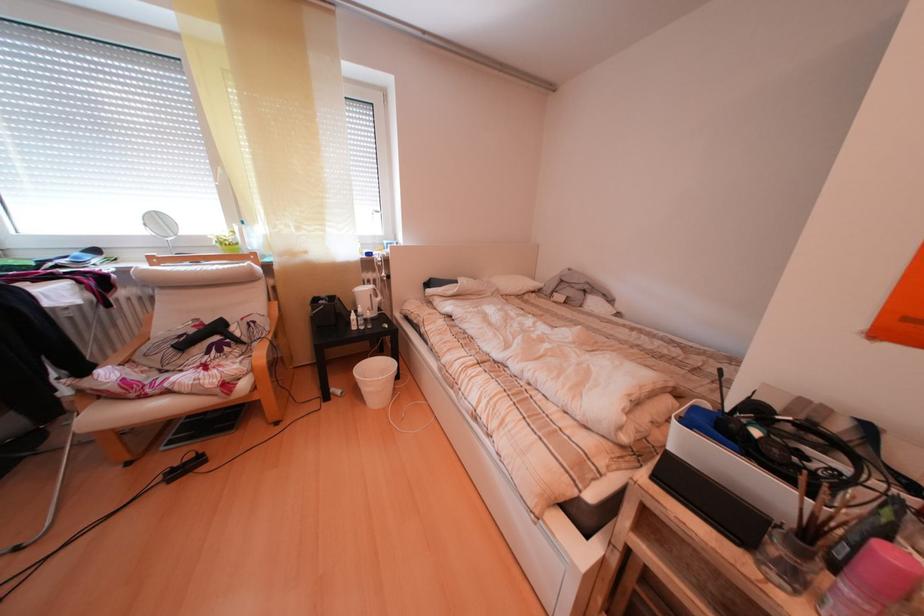
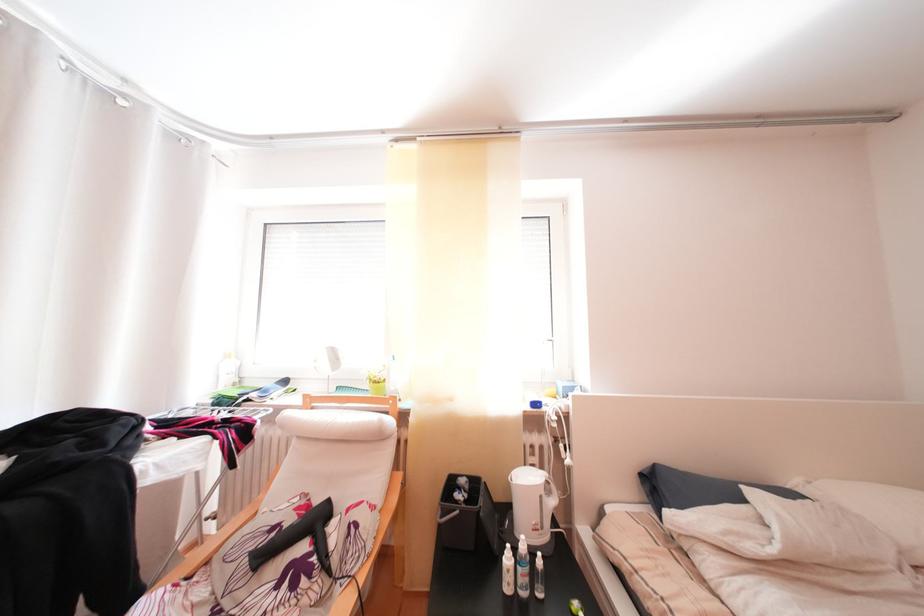
Locate, in the second image, the point that corresponds to (371,315) in the first image.

(536, 553)